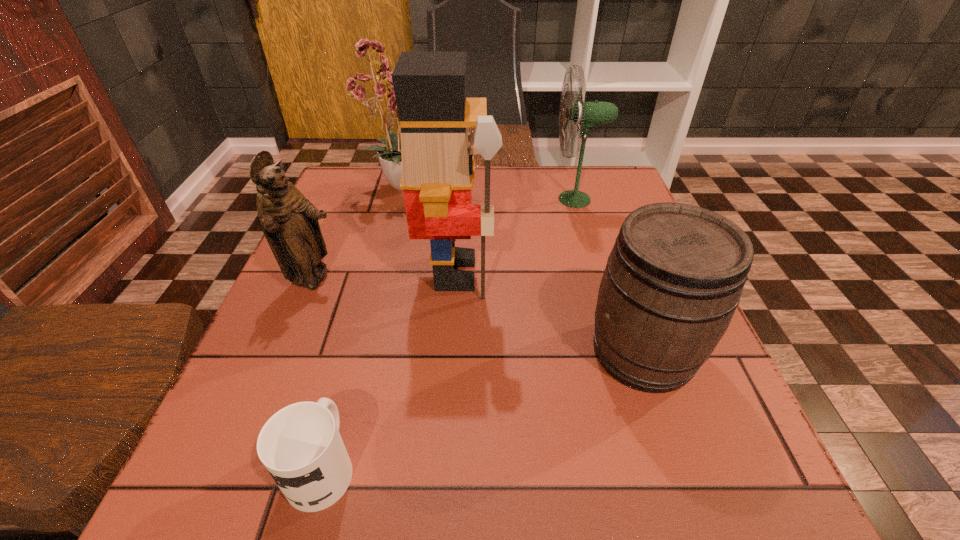
The image size is (960, 540). Identify the location of vacant area between the figurine and the mug. (318, 373).

I want to click on unoccupied position between the figurine and the flower arrangement, so click(361, 232).

Image resolution: width=960 pixels, height=540 pixels. What are the coordinates of `unoccupied position between the second nearest object and the figurine` in the screenshot? It's located at pyautogui.click(x=478, y=315).

Where is `free space between the fifth farthest object and the nutcracker`? The image size is (960, 540). free space between the fifth farthest object and the nutcracker is located at coordinates pyautogui.click(x=549, y=313).

The image size is (960, 540). Find the location of `unoccupied area between the figurine and the nutcracker`. unoccupied area between the figurine and the nutcracker is located at coordinates (385, 276).

The width and height of the screenshot is (960, 540). In order to click on vacant area between the figurine and the nutcracker in this screenshot , I will do `click(385, 276)`.

You are a GUI agent. You are given a task and a screenshot of the screen. Output one action in this format:
    pyautogui.click(x=<x>, y=<y>)
    Task: Click on the third closest object to the fan
    Image resolution: width=960 pixels, height=540 pixels.
    Given the screenshot: What is the action you would take?
    pyautogui.click(x=674, y=278)

At what (x,y) coordinates should I click in order to perform the action: click on object that is the third closest one to the mug. Please return your answer as a coordinate pair (x, y). This screenshot has height=540, width=960. Looking at the image, I should click on (674, 278).

Locate an element on the screen. The height and width of the screenshot is (540, 960). vacant region that satisfies the following two spatial constraints: 1. on the handle side of the shortest object; 2. on the front-facing side of the figurine is located at coordinates (372, 279).

Identify the location of vacant space that satisfies the following two spatial constraints: 1. on the handle side of the mug; 2. on the front-facing side of the figurine. (372, 279).